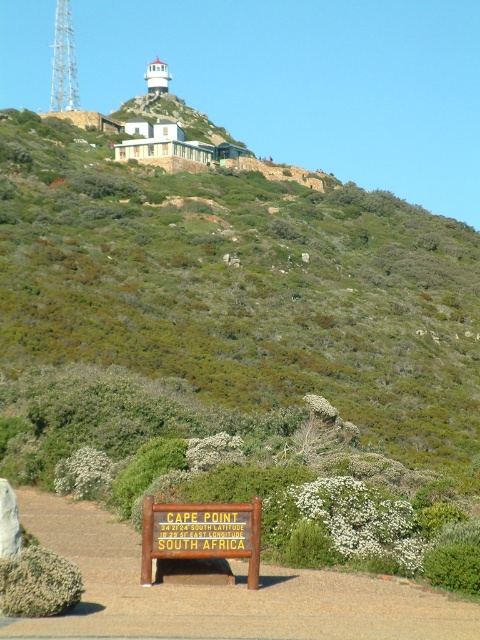
Question: Which point is farther from the camera taking this photo?

Choices:
 (A) [0, 176]
 (B) [173, 522]

Answer: (A)

Question: From the image, what is the correct spatial relationship of green shrubbery at upper center in relation to brown wooden sign at lower center?

Choices:
 (A) right
 (B) left

Answer: (A)

Question: Can you confirm if green shrubbery at upper center is positioned to the left of brown wooden sign at lower center?

Choices:
 (A) yes
 (B) no

Answer: (B)

Question: Is green shrubbery at upper center thinner than brown wooden sign at lower center?

Choices:
 (A) no
 (B) yes

Answer: (A)

Question: Among these points, which one is nearest to the camera?

Choices:
 (A) (213, 504)
 (B) (348, 390)

Answer: (A)